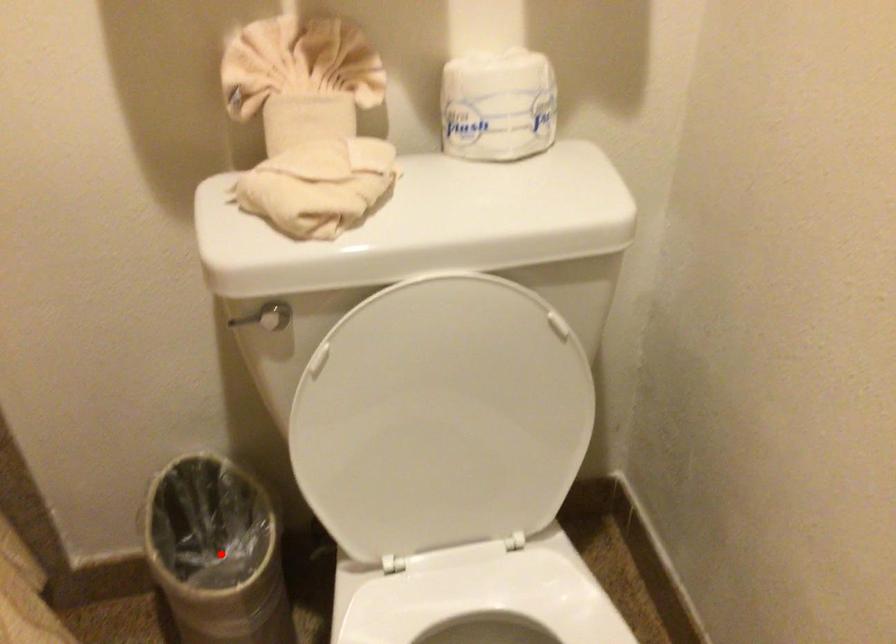
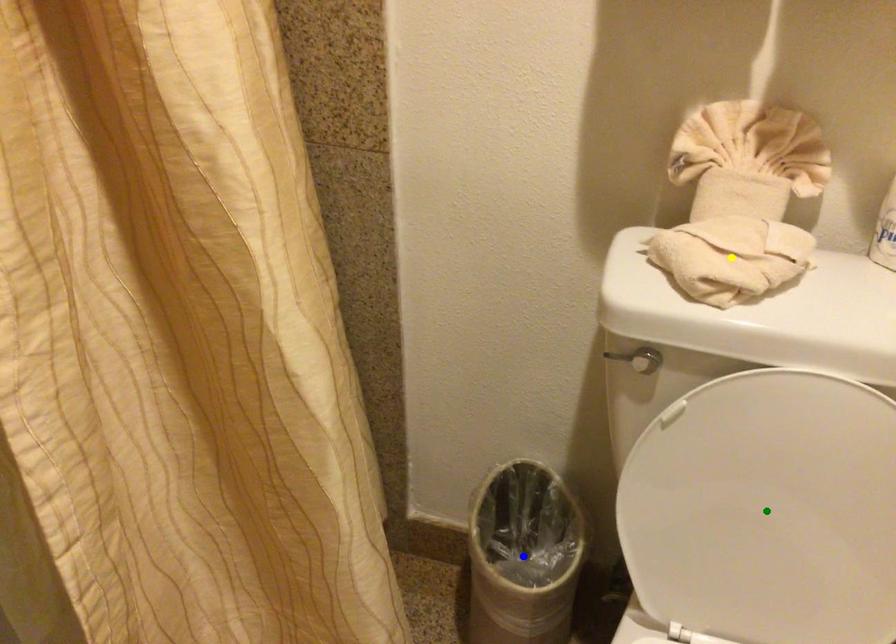
Question: I am providing you with two images of the same scene from different viewpoints. A red point is marked on the first image. You are given multiple points on the second image. Which point in image 2 represents the same 3d spot as the red point in image 1?

Choices:
 (A) yellow point
 (B) blue point
 (C) green point

Answer: (B)